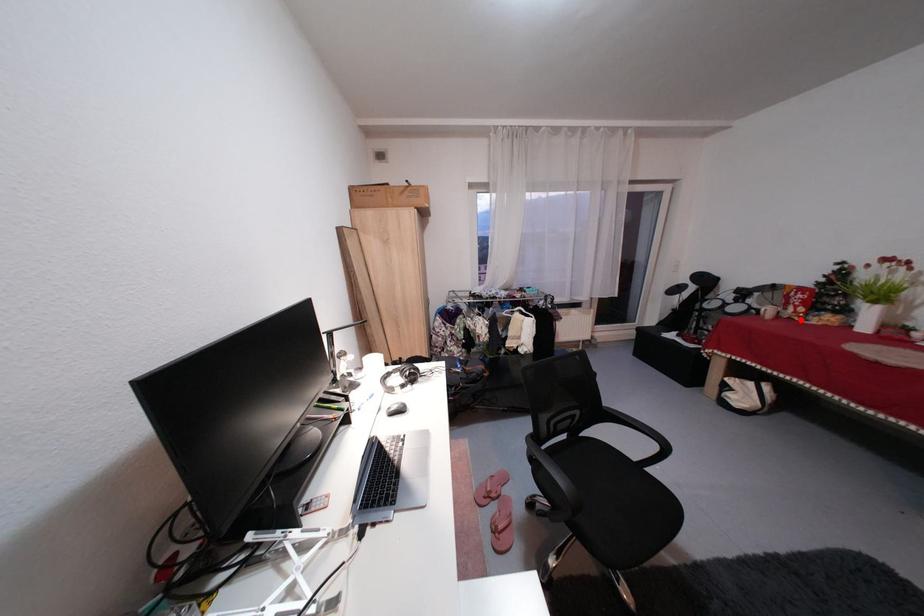
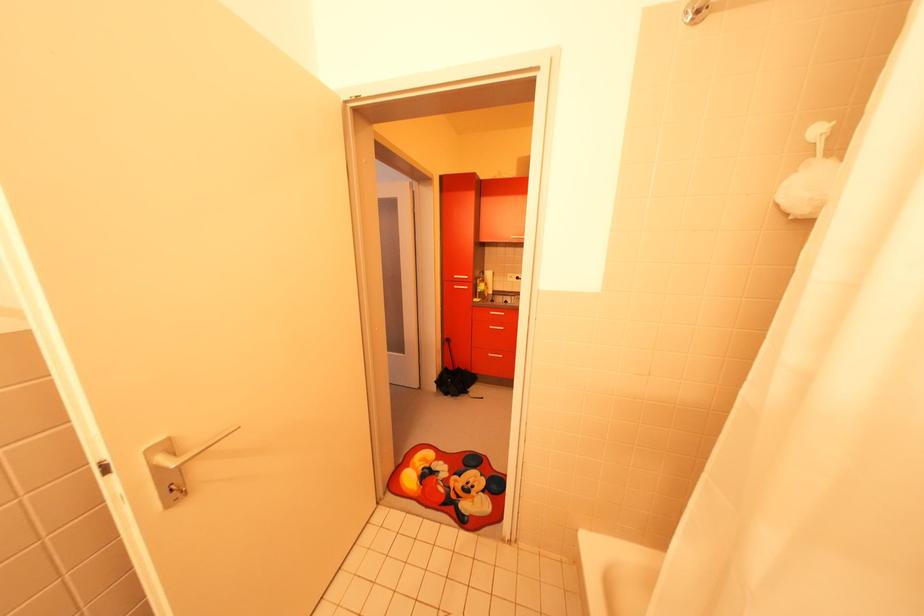
Question: I am providing you with two images of the same scene from different viewpoints. A red point is marked on the first image. Can you still see the location of the red point in image 2?

Choices:
 (A) Yes
 (B) No

Answer: (B)